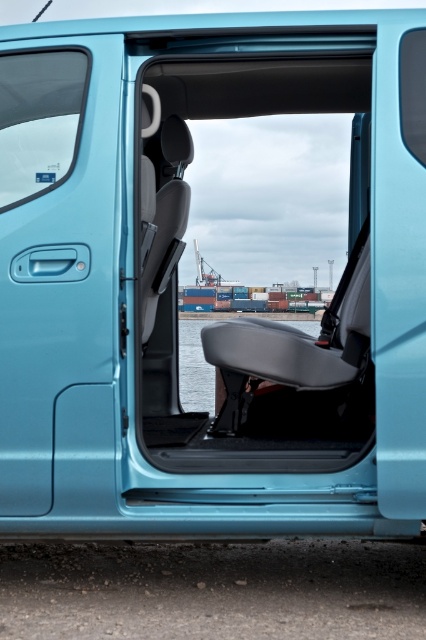
You are standing inside the van and want to exit through the open door. There is a point marked at coordinates (57, 272). Is this point located on the door you need to exit through?

The point at coordinates (57, 272) is on the light blue metallic door at left, which is not the open rear passenger door. Therefore, the point is not on the door you need to exit through.

You are standing inside the van and want to exit through the light blue metallic door at left. Based on its position, where should you walk towards to exit?

The light blue metallic door at left is located at point (57,272), so you should walk towards the left side of the van to exit through the light blue metallic door at left.

You are a delivery person who needs to load a package into the van. The package is too large to fit through the door. Which object in the van, the light blue metallic door at left or the transparent water at seat center, is closer to the open rear passenger door?

The light blue metallic door at left is closer to the open rear passenger door because it is positioned to the left of the transparent water at seat center, which is further away from the door.